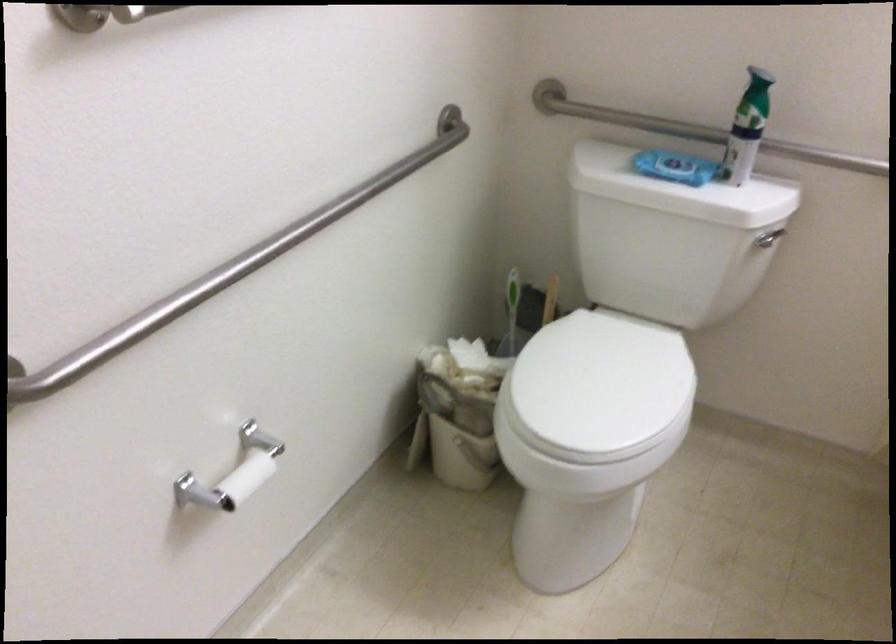
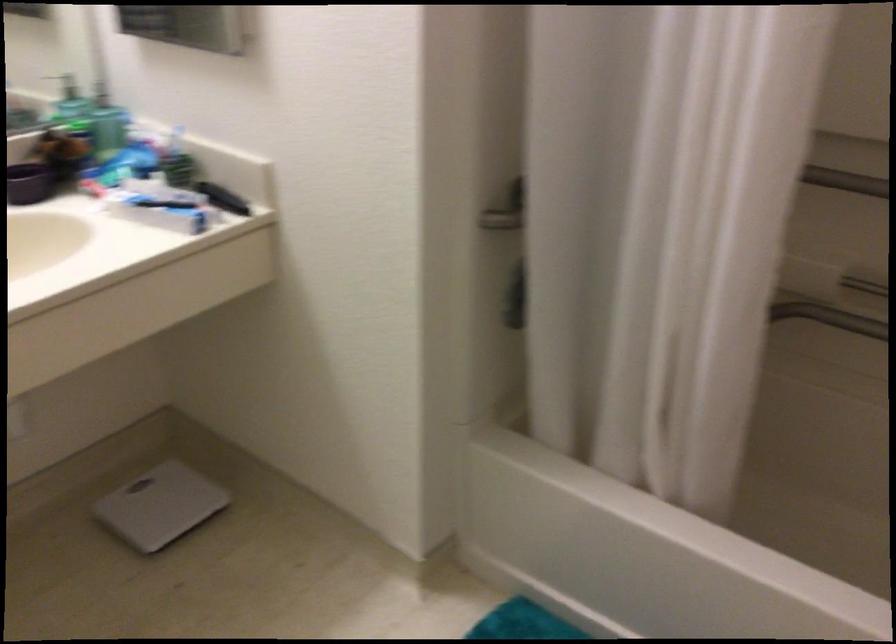
From the picture: The images are taken continuously from a first-person perspective. In which direction is your viewpoint rotating?

The camera rotated toward right-down.